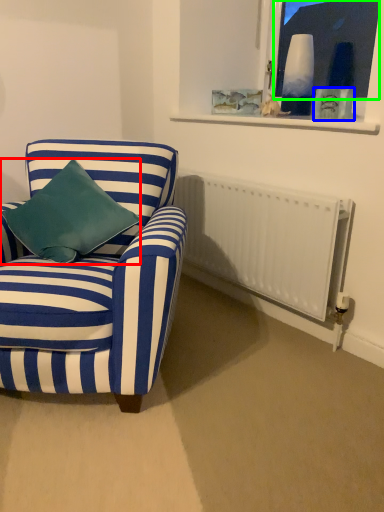
Question: Considering the real-world distances, which object is closest to pillow (highlighted by a red box)? picture frame (highlighted by a blue box) or window screen (highlighted by a green box).

Choices:
 (A) picture frame
 (B) window screen

Answer: (A)